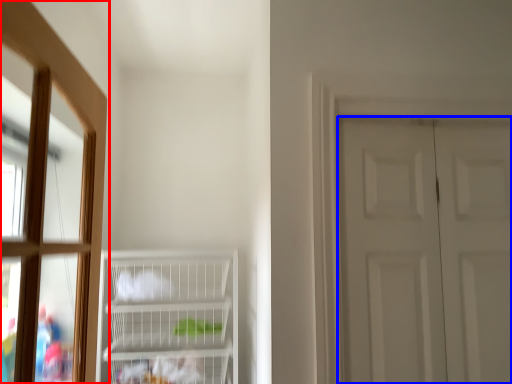
Question: Which point is further to the camera, window (highlighted by a red box) or door (highlighted by a blue box)?

Choices:
 (A) window
 (B) door

Answer: (B)